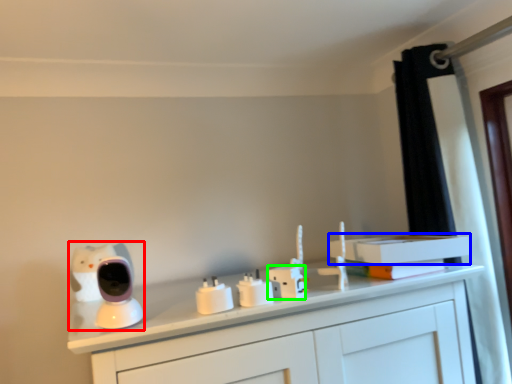
Question: Which object is positioned farthest from toy (highlighted by a red box)? Select from book (highlighted by a blue box) and electric outlet (highlighted by a green box).

Choices:
 (A) book
 (B) electric outlet

Answer: (A)